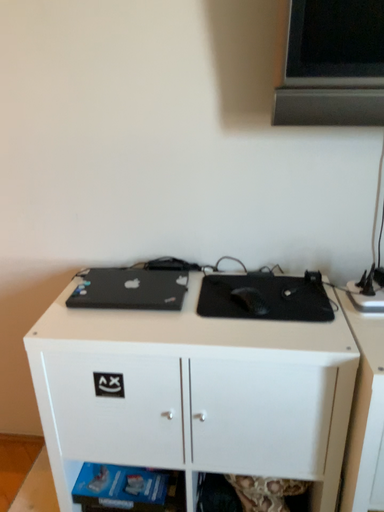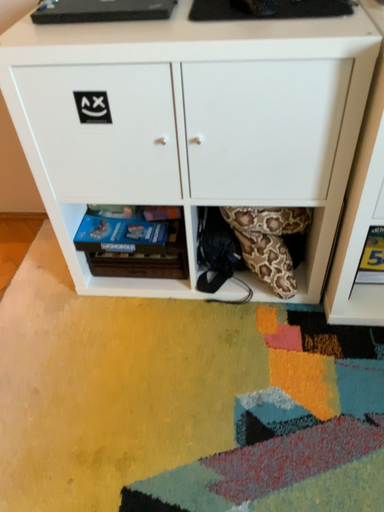
Question: How did the camera likely rotate when shooting the video?

Choices:
 (A) rotated downward
 (B) rotated upward

Answer: (A)